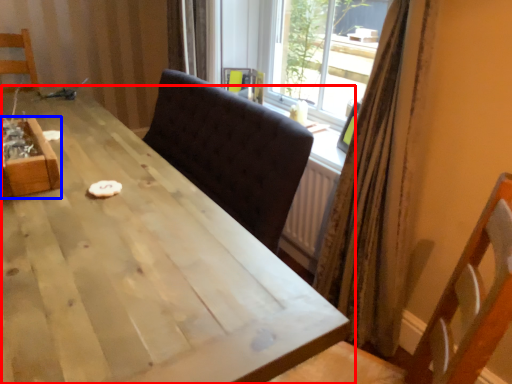
Question: Among these objects, which one is nearest to the camera, table (highlighted by a red box) or crate (highlighted by a blue box)?

Choices:
 (A) table
 (B) crate

Answer: (A)